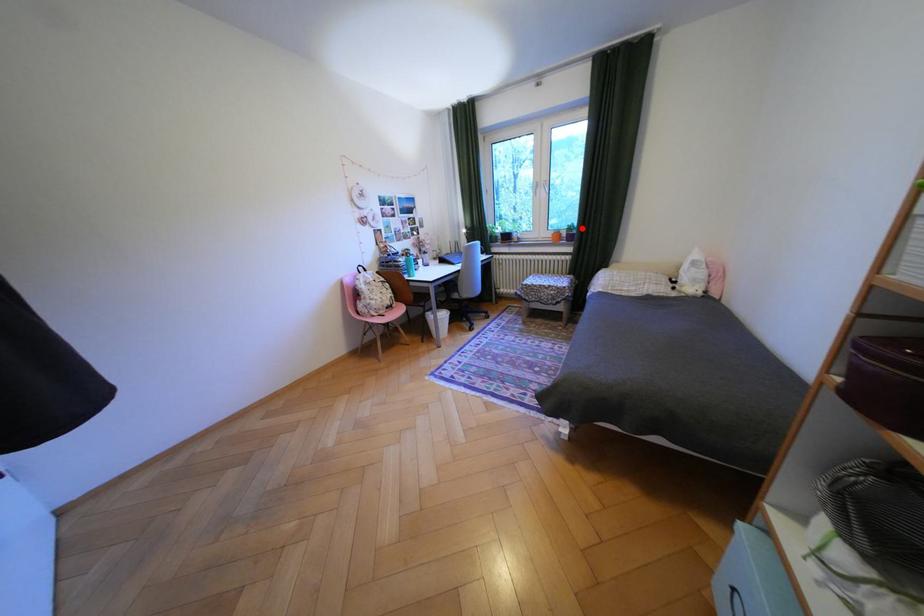
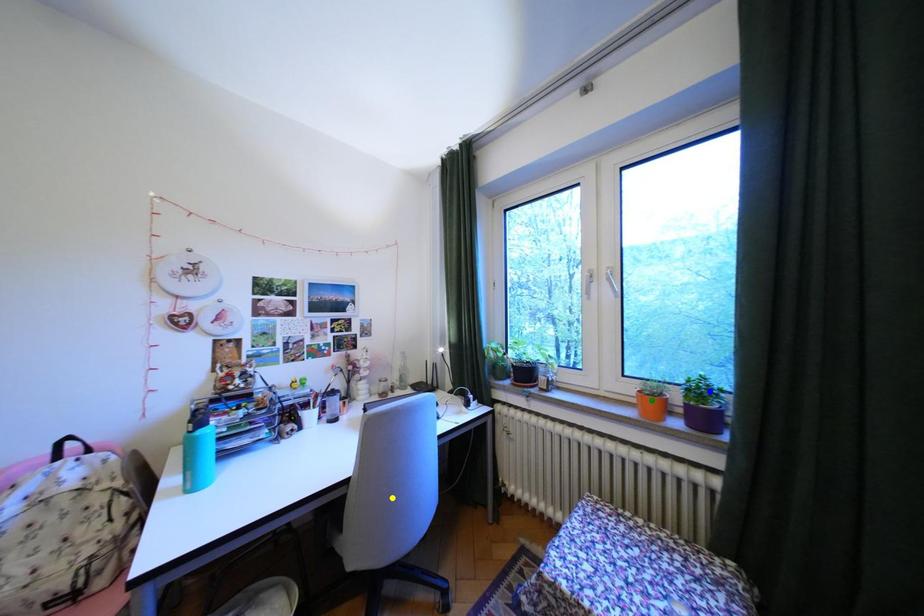
Question: I am providing you with two images of the same scene from different viewpoints. A red point is marked on the first image. You are given multiple points on the second image. Which point in image 2 represents the same 3d spot as the red point in image 1?

Choices:
 (A) yellow point
 (B) blue point
 (C) green point

Answer: (B)